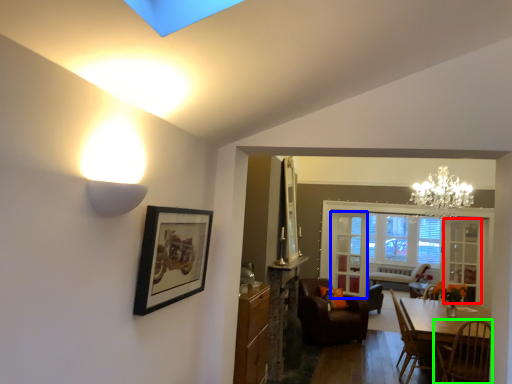
Question: Estimate the real-world distances between objects in this image. Which object is closer to glass door (highlighted by a red box), glass door (highlighted by a blue box) or chair (highlighted by a green box)?

Choices:
 (A) glass door
 (B) chair

Answer: (A)